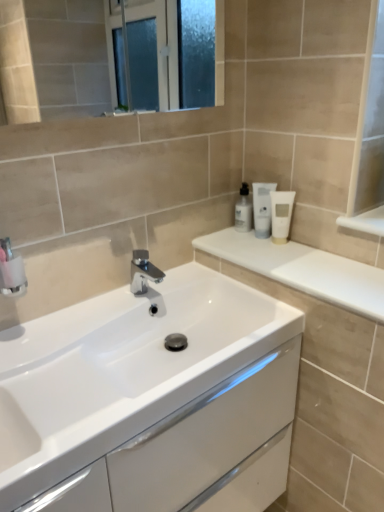
You are a GUI agent. You are given a task and a screenshot of the screen. Output one action in this format:
    pyautogui.click(x=<x>, y=<y>)
    Task: Click on the free space in front of white matte tube at upper right, which is the 2th toiletry from right to left
    
    Given the screenshot: What is the action you would take?
    pyautogui.click(x=276, y=259)